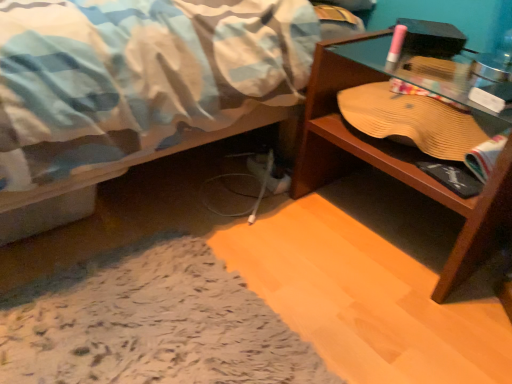
Question: Is wooden desk at right in front of or behind transparent glass table at right in the image?

Choices:
 (A) behind
 (B) front

Answer: (B)

Question: Does point (499, 198) appear closer or farther from the camera than point (378, 46)?

Choices:
 (A) closer
 (B) farther

Answer: (A)

Question: In terms of width, does wooden desk at right look wider or thinner when compared to transparent glass table at right?

Choices:
 (A) thin
 (B) wide

Answer: (B)

Question: In terms of size, does transparent glass table at right appear bigger or smaller than wooden desk at right?

Choices:
 (A) small
 (B) big

Answer: (A)

Question: From a real-world perspective, is transparent glass table at right physically located above or below wooden desk at right?

Choices:
 (A) below
 (B) above

Answer: (B)

Question: Is transparent glass table at right situated inside wooden desk at right or outside?

Choices:
 (A) inside
 (B) outside

Answer: (A)

Question: Based on their positions, is transparent glass table at right located to the left or right of wooden desk at right?

Choices:
 (A) left
 (B) right

Answer: (A)